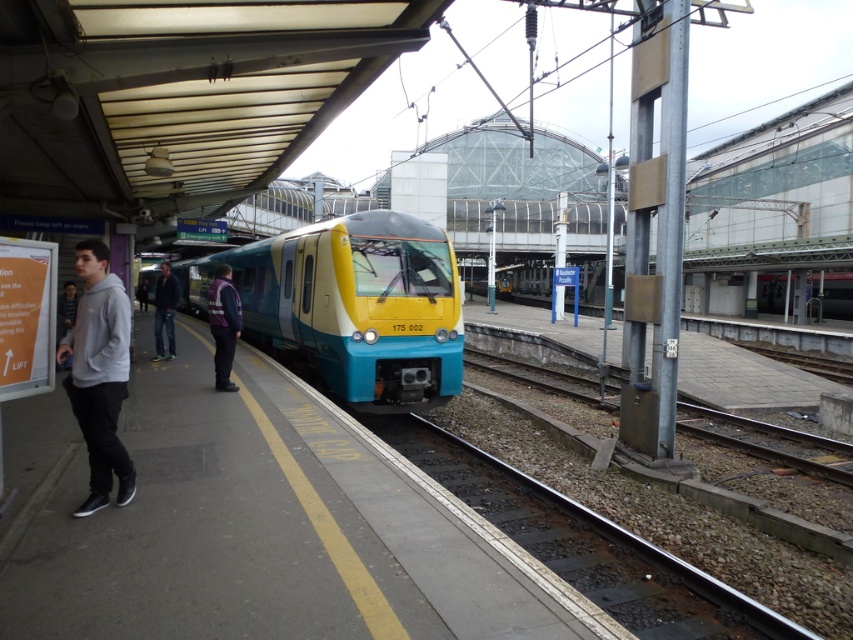
Question: Which point appears closest to the camera in this image?

Choices:
 (A) (74, 385)
 (B) (154, 356)
 (C) (218, 314)
 (D) (799, 458)

Answer: (A)

Question: Does gray gravel train track at center come behind reflective purple jacket at center?

Choices:
 (A) no
 (B) yes

Answer: (A)

Question: Is gray fleece at left behind dark blue jeans at left?

Choices:
 (A) no
 (B) yes

Answer: (A)

Question: Does smooth metal train track at center appear on the right side of dark blue jeans at left?

Choices:
 (A) no
 (B) yes

Answer: (B)

Question: Which object appears farthest from the camera in this image?

Choices:
 (A) smooth metal train track at center
 (B) reflective purple jacket at center
 (C) gray gravel train track at center

Answer: (B)

Question: Which point is closer to the camera taking this photo?

Choices:
 (A) (85, 376)
 (B) (225, 371)
 (C) (715, 433)

Answer: (A)